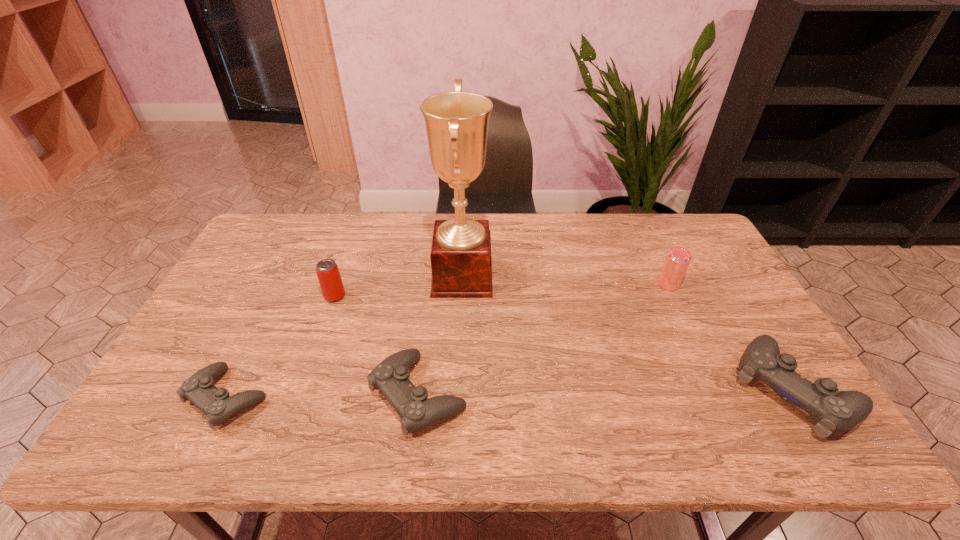
The width and height of the screenshot is (960, 540). Identify the location of the shortest control. (199, 389).

Where is `the leftmost object`? This screenshot has height=540, width=960. the leftmost object is located at coordinates (199, 389).

What are the coordinates of `the second shortest object` in the screenshot? It's located at (391, 376).

Locate an element on the screen. the second control from right to left is located at coordinates (391, 376).

Locate an element on the screen. The width and height of the screenshot is (960, 540). the rightmost control is located at coordinates (833, 412).

Find the location of `the tallest control`. the tallest control is located at coordinates (833, 412).

This screenshot has height=540, width=960. What are the coordinates of `the left beer can` in the screenshot? It's located at (328, 274).

Identify the location of trophy cup. The width and height of the screenshot is (960, 540). (456, 122).

Image resolution: width=960 pixels, height=540 pixels. I want to click on the fifth object from left to right, so click(677, 260).

Where is `vacant space located 0.180m on the back of the shortest object`? Image resolution: width=960 pixels, height=540 pixels. vacant space located 0.180m on the back of the shortest object is located at coordinates (268, 315).